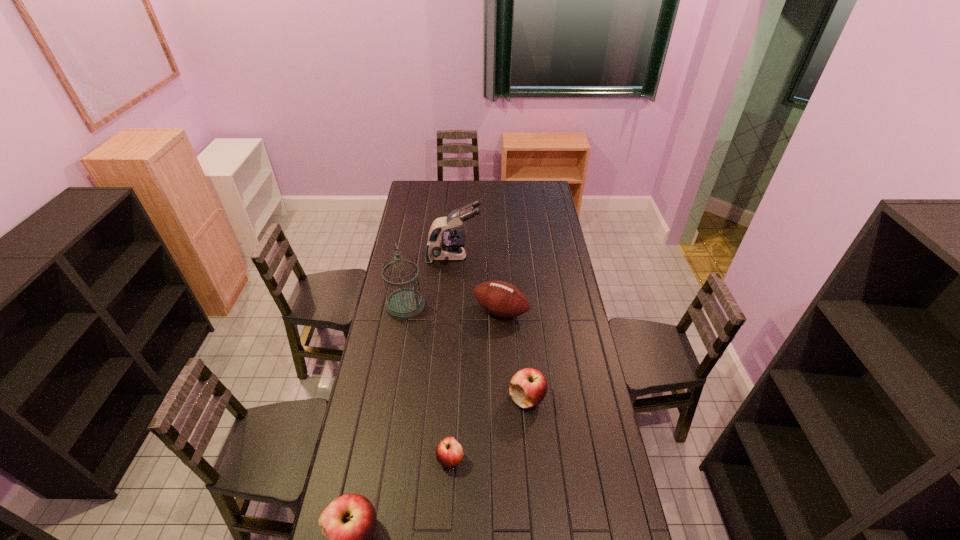
You are a GUI agent. You are given a task and a screenshot of the screen. Output one action in this format:
    pyautogui.click(x=<x>, y=<y>)
    Task: Click on the free space that is in between the second apple from left to right and the third nearest object
    This screenshot has width=960, height=540.
    Given the screenshot: What is the action you would take?
    pyautogui.click(x=489, y=429)

The width and height of the screenshot is (960, 540). Identify the location of free space between the second apple from right to left and the birdcage. (428, 382).

Identify which object is located as the fifth nearest to the nearest object. Please provide its 2D coordinates. Your answer should be formatted as a tuple, i.e. [(x, y)], where the tuple contains the x and y coordinates of a point satisfying the conditions above.

[(449, 246)]

This screenshot has height=540, width=960. In order to click on object that is the second closest to the football (American) in this screenshot , I will do `click(405, 303)`.

The width and height of the screenshot is (960, 540). I want to click on the closest apple to the second apple from left to right, so click(348, 523).

In order to click on apple object that ranks as the closest to the football (American) in this screenshot , I will do `click(528, 387)`.

At what (x,y) coordinates should I click in order to perform the action: click on blank area in the image that satisfies the following two spatial constraints: 1. through the eyepieces of the microscope; 2. on the left side of the rightmost apple. Please return your answer as a coordinate pair (x, y). The image size is (960, 540). Looking at the image, I should click on [x=444, y=399].

Find the location of a particular element. free point that satisfies the following two spatial constraints: 1. on the front-facing side of the birdcage; 2. on the right side of the second apple from left to right is located at coordinates tap(378, 459).

Where is `vacant space that satisfies the following two spatial constraints: 1. on the front-facing side of the birdcage; 2. on the back side of the rightmost apple`? This screenshot has width=960, height=540. vacant space that satisfies the following two spatial constraints: 1. on the front-facing side of the birdcage; 2. on the back side of the rightmost apple is located at coordinates (389, 399).

The image size is (960, 540). What are the coordinates of `vacant space that satisfies the following two spatial constraints: 1. through the eyepieces of the farthest object; 2. on the left side of the rightmost apple` in the screenshot? It's located at (444, 399).